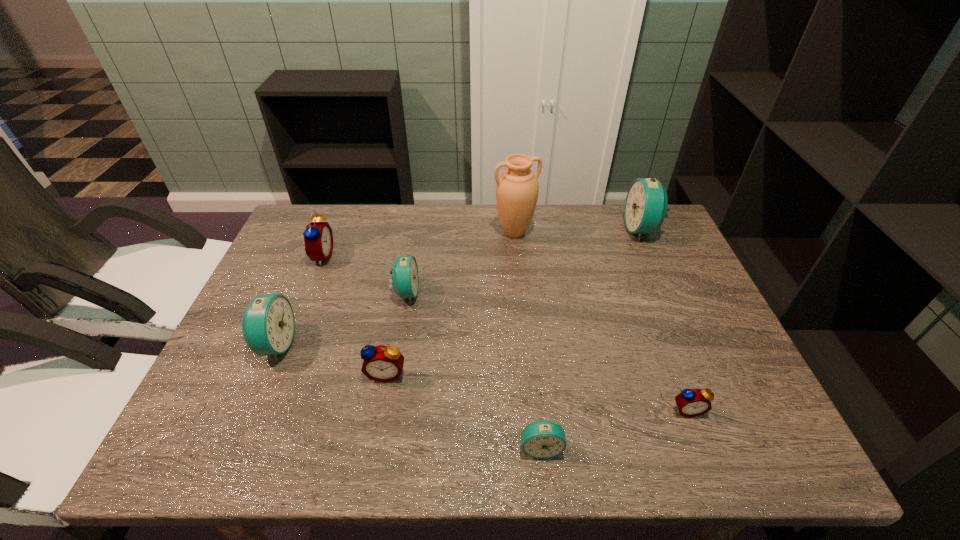
At what (x,y) coordinates should I click in order to perform the action: click on vacant area that lies between the second biggest red alarm clock and the third alarm clock from right to left. Please return your answer as a coordinate pair (x, y). This screenshot has width=960, height=540. Looking at the image, I should click on (464, 410).

At what (x,y) coordinates should I click in order to perform the action: click on free space that is in between the smallest blue alarm clock and the second smallest blue alarm clock. Please return your answer as a coordinate pair (x, y). Looking at the image, I should click on point(473,370).

Locate an element on the screen. unoccupied position between the nearest alarm clock and the biggest red alarm clock is located at coordinates (431, 352).

Locate an element on the screen. free space between the nearest blue alarm clock and the tallest alarm clock is located at coordinates (591, 339).

Choose which object is the seventh nearest neighbor to the biggest blue alarm clock. Please provide its 2D coordinates. Your answer should be formatted as a tuple, i.e. [(x, y)], where the tuple contains the x and y coordinates of a point satisfying the conditions above.

[(268, 324)]

Select which object is the seventh closest to the second farthest blue alarm clock. Please provide its 2D coordinates. Your answer should be formatted as a tuple, i.e. [(x, y)], where the tuple contains the x and y coordinates of a point satisfying the conditions above.

[(646, 203)]

Choose which alarm clock is the third nearest neighbor to the leftmost red alarm clock. Please provide its 2D coordinates. Your answer should be formatted as a tuple, i.e. [(x, y)], where the tuple contains the x and y coordinates of a point satisfying the conditions above.

[(381, 363)]

This screenshot has width=960, height=540. In order to click on alarm clock that is the third closest to the third blue alarm clock from left to right in this screenshot , I will do `click(405, 279)`.

Select which blue alarm clock appears as the fourth closest to the nearest red alarm clock. Please provide its 2D coordinates. Your answer should be formatted as a tuple, i.e. [(x, y)], where the tuple contains the x and y coordinates of a point satisfying the conditions above.

[(268, 324)]

The height and width of the screenshot is (540, 960). In order to click on blue alarm clock that is the fourth closest to the tallest object in this screenshot , I will do `click(543, 439)`.